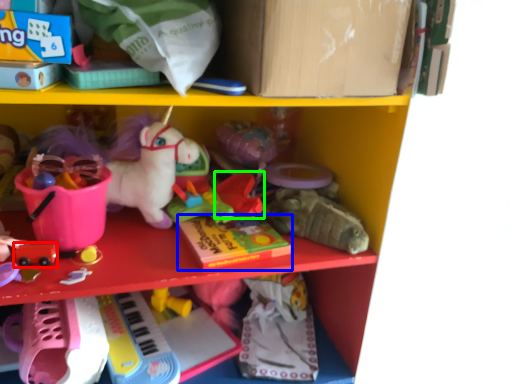
Question: Which object is the farthest from toy (highlighted by a red box)? Choose among these: book (highlighted by a blue box) or toy (highlighted by a green box).

Choices:
 (A) book
 (B) toy

Answer: (B)